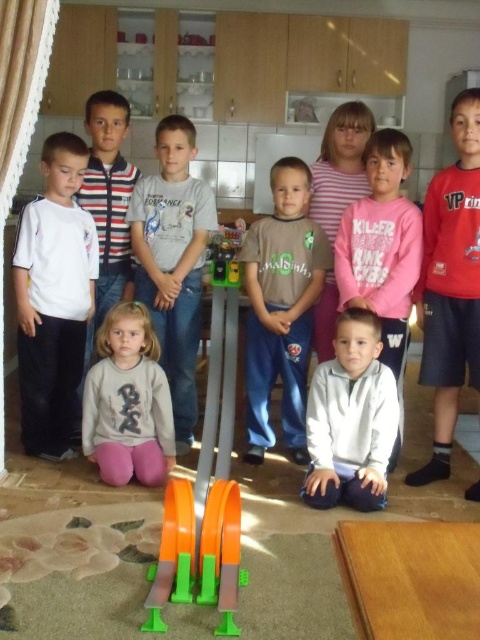
You are a photographer trying to position a new prop at the same location as the brown cotton shirt at center. What are the coordinates where you should place the prop?

The coordinates for the brown cotton shirt at center are at point (x=282, y=307), so you should place the prop there.

You are a photographer trying to focus on the white cotton shirt at left. What are the coordinates where you should aim your camera?

The white cotton shirt at left is located at coordinates point [54,298].